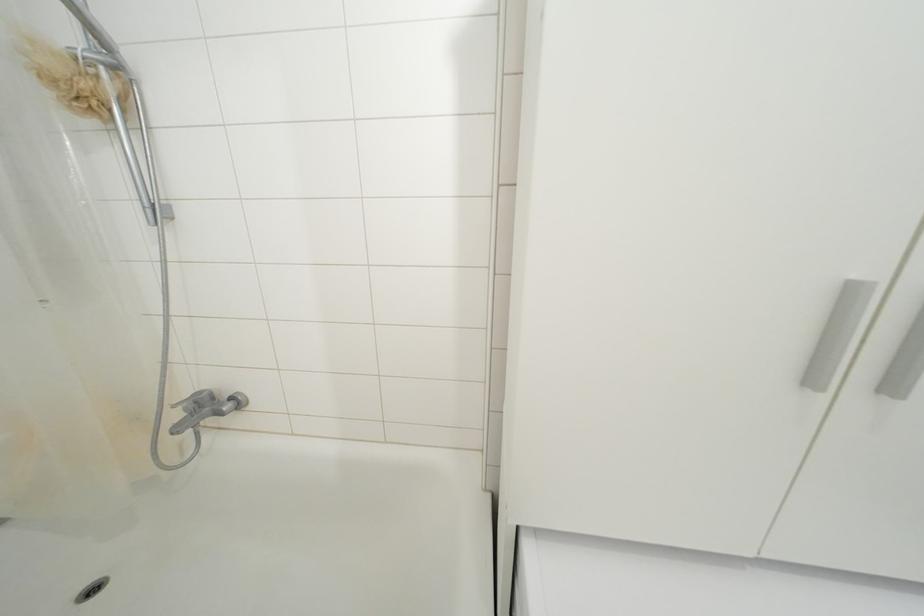
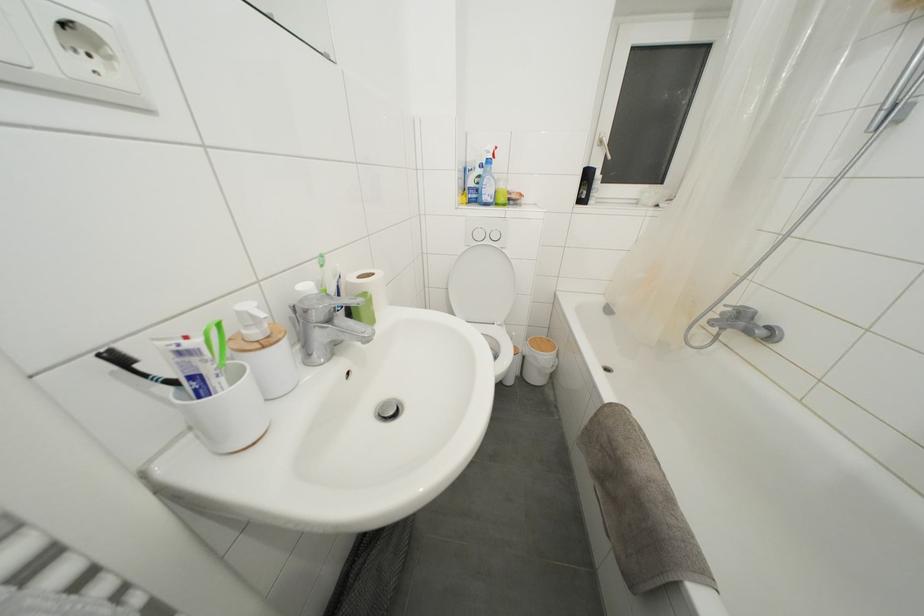
The first image is from the beginning of the video and the second image is from the end. How did the camera likely rotate when shooting the video?

The camera rotated toward left-down.